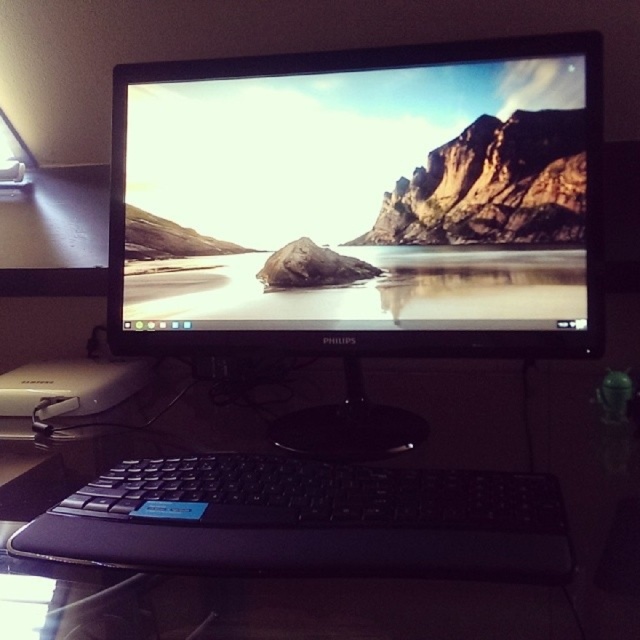
You are a virtual assistant navigating a digital workspace. You need to move from your current position to a target located at point (x=426, y=566). There is an obstacle at point (x=288, y=250). Can you safely reach the target without passing through the obstacle?

Point (x=288, y=250) is behind point (x=426, y=566), so you can safely reach the target at point (x=426, y=566) without passing through the obstacle at point (x=288, y=250).

You are organizing your desk and want to place a 25 centimeter long cable between the black glossy monitor at center and the black plastic keyboard at center. Can the cable reach both devices without needing to be extended?

The black glossy monitor at center is 25.14 centimeters away from the black plastic keyboard at center. Since the cable is only 25 centimeters long, it is 0.14 centimeters too short to reach both devices without extension.

You are setting up a new workspace and want to place a decorative item between the black plastic keyboard at lower center and the black plastic keyboard at center. Is there enough space for it?

The black plastic keyboard at lower center is positioned over the black plastic keyboard at center, meaning there is no space between them. Therefore, there is no room to place a decorative item between them.